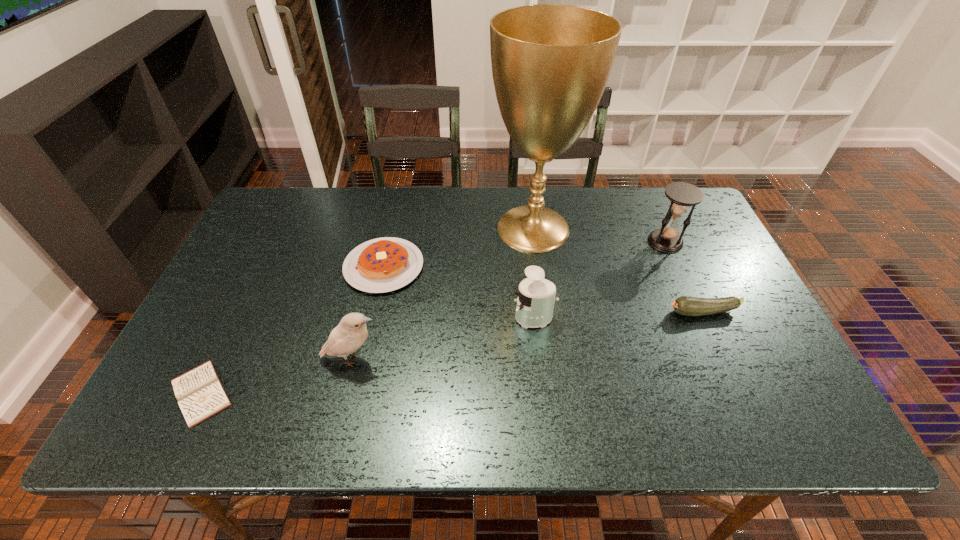
In order to click on object that is at the left edge in this screenshot , I will do `click(200, 394)`.

At what (x,y) coordinates should I click in order to perform the action: click on hourglass that is at the right edge. Please return your answer as a coordinate pair (x, y). This screenshot has height=540, width=960. Looking at the image, I should click on (682, 195).

The height and width of the screenshot is (540, 960). Identify the location of zucchini present at the right edge. (687, 306).

Where is `object positioned at the near left corner`? Image resolution: width=960 pixels, height=540 pixels. object positioned at the near left corner is located at coordinates (200, 394).

You are a GUI agent. You are given a task and a screenshot of the screen. Output one action in this format:
    pyautogui.click(x=<x>, y=<y>)
    Task: Click on the object that is at the far right corner
    The image size is (960, 540).
    Given the screenshot: What is the action you would take?
    pyautogui.click(x=682, y=195)

The image size is (960, 540). Identify the location of vacant space at the far edge of the desktop. click(618, 222).

The height and width of the screenshot is (540, 960). I want to click on free space at the near edge of the desktop, so click(247, 422).

Where is `vacant space at the left edge of the desktop`? vacant space at the left edge of the desktop is located at coordinates (204, 312).

Where is `vacant space at the right edge of the desktop`? The width and height of the screenshot is (960, 540). vacant space at the right edge of the desktop is located at coordinates (743, 303).

This screenshot has width=960, height=540. In the image, there is a desktop. What are the coordinates of `vacant region at the far left corner` in the screenshot? It's located at (315, 189).